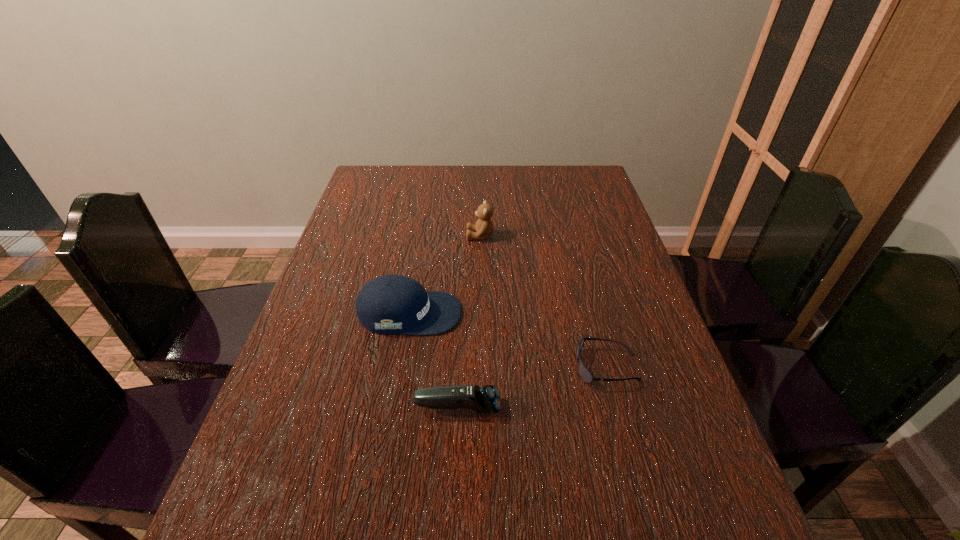
Image resolution: width=960 pixels, height=540 pixels. What are the coordinates of `free space located on the head of the electric shaver` in the screenshot? It's located at (597, 407).

The height and width of the screenshot is (540, 960). Identify the location of vacant point located on the lenses of the sunglasses. (412, 367).

The image size is (960, 540). I want to click on vacant region located on the lenses of the sunglasses, so click(x=529, y=367).

Locate an element on the screen. vacant area situated on the lenses of the sunglasses is located at coordinates tap(496, 367).

You are a GUI agent. You are given a task and a screenshot of the screen. Output one action in this format:
    pyautogui.click(x=<x>, y=<y>)
    Task: Click on the object that is at the left edge
    This screenshot has height=540, width=960.
    Given the screenshot: What is the action you would take?
    pyautogui.click(x=389, y=304)

Find the location of `object that is positioned at the right edge`. object that is positioned at the right edge is located at coordinates (585, 374).

You are a GUI agent. You are given a task and a screenshot of the screen. Output one action in this format:
    pyautogui.click(x=<x>, y=<y>)
    Task: Click on the vacant space at the far edge of the desktop
    This screenshot has height=540, width=960.
    Given the screenshot: What is the action you would take?
    pyautogui.click(x=467, y=196)

Identify the location of vacant point at the left edge. (377, 249).

At what (x,y) coordinates should I click in order to perform the action: click on vacant space at the right edge of the desktop. Please return your answer as a coordinate pair (x, y). The image size is (960, 540). Looking at the image, I should click on (624, 245).

Where is `free space at the far left corner of the desktop`? This screenshot has height=540, width=960. free space at the far left corner of the desktop is located at coordinates (387, 188).